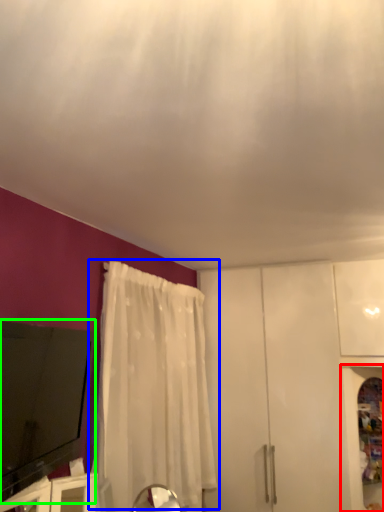
Question: Estimate the real-world distances between objects in this image. Which object is farther from cabinetry (highlighted by a red box), curtain (highlighted by a blue box) or electronic (highlighted by a green box)?

Choices:
 (A) curtain
 (B) electronic

Answer: (B)